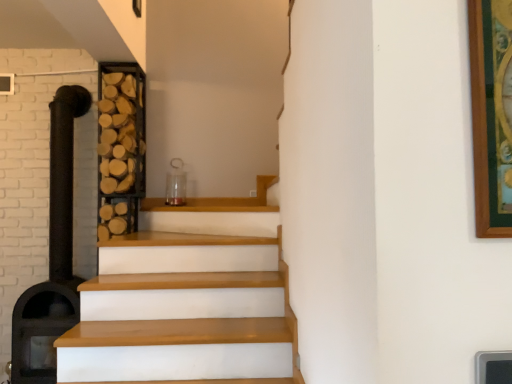
Question: In terms of height, does wooden at left look taller or shorter compared to black matte fireplace at left?

Choices:
 (A) short
 (B) tall

Answer: (A)

Question: In the image, is wooden at left on the left side or the right side of black matte fireplace at left?

Choices:
 (A) left
 (B) right

Answer: (B)

Question: From the image's perspective, is wooden at left above or below black matte fireplace at left?

Choices:
 (A) above
 (B) below

Answer: (A)

Question: Considering the positions of black matte fireplace at left and wooden at left in the image, is black matte fireplace at left taller or shorter than wooden at left?

Choices:
 (A) tall
 (B) short

Answer: (A)

Question: Considering the positions of black matte fireplace at left and wooden at left in the image, is black matte fireplace at left wider or thinner than wooden at left?

Choices:
 (A) thin
 (B) wide

Answer: (B)

Question: From the image's perspective, is black matte fireplace at left positioned above or below wooden at left?

Choices:
 (A) above
 (B) below

Answer: (B)

Question: Based on their sizes in the image, would you say black matte fireplace at left is bigger or smaller than wooden at left?

Choices:
 (A) small
 (B) big

Answer: (B)